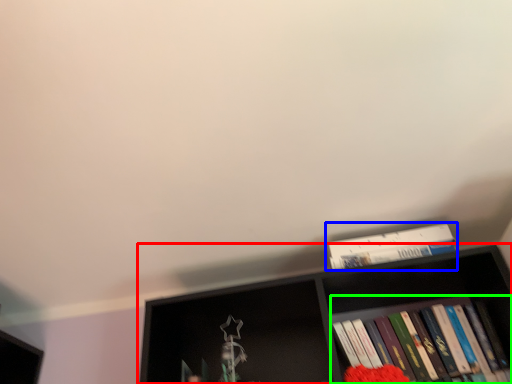
Question: Which object is positioned closest to shelf (highlighted by a red box)? Select from book (highlighted by a blue box) and book (highlighted by a green box).

Choices:
 (A) book
 (B) book

Answer: (B)